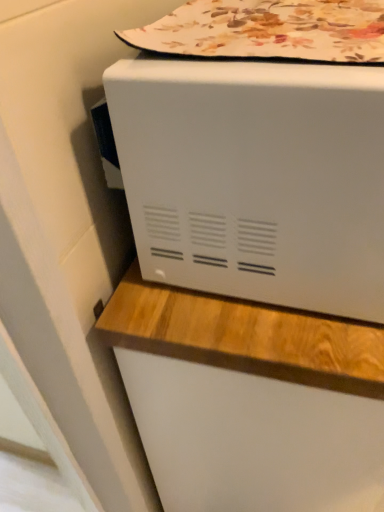
Question: Is white matte microwave at upper center turned away from floral fabric at upper center?

Choices:
 (A) yes
 (B) no

Answer: (B)

Question: From a real-world perspective, is white matte microwave at upper center physically below floral fabric at upper center?

Choices:
 (A) yes
 (B) no

Answer: (A)

Question: Considering the relative positions of white matte microwave at upper center and floral fabric at upper center in the image provided, is white matte microwave at upper center in front of floral fabric at upper center?

Choices:
 (A) yes
 (B) no

Answer: (A)

Question: From a real-world perspective, is white matte microwave at upper center physically above floral fabric at upper center?

Choices:
 (A) no
 (B) yes

Answer: (A)

Question: Does white matte microwave at upper center turn towards floral fabric at upper center?

Choices:
 (A) yes
 (B) no

Answer: (B)

Question: Is white matte microwave at upper center located outside floral fabric at upper center?

Choices:
 (A) yes
 (B) no

Answer: (A)

Question: Is floral fabric at upper center closer to the viewer compared to white matte microwave at upper center?

Choices:
 (A) yes
 (B) no

Answer: (B)

Question: Does floral fabric at upper center have a smaller size compared to white matte microwave at upper center?

Choices:
 (A) yes
 (B) no

Answer: (A)

Question: Is the depth of floral fabric at upper center greater than that of white matte microwave at upper center?

Choices:
 (A) yes
 (B) no

Answer: (A)

Question: From the image's perspective, is floral fabric at upper center under white matte microwave at upper center?

Choices:
 (A) no
 (B) yes

Answer: (A)

Question: Does floral fabric at upper center have a greater height compared to white matte microwave at upper center?

Choices:
 (A) yes
 (B) no

Answer: (B)

Question: Is floral fabric at upper center positioned far away from white matte microwave at upper center?

Choices:
 (A) no
 (B) yes

Answer: (A)

Question: From their relative heights in the image, would you say white matte microwave at upper center is taller or shorter than floral fabric at upper center?

Choices:
 (A) short
 (B) tall

Answer: (B)